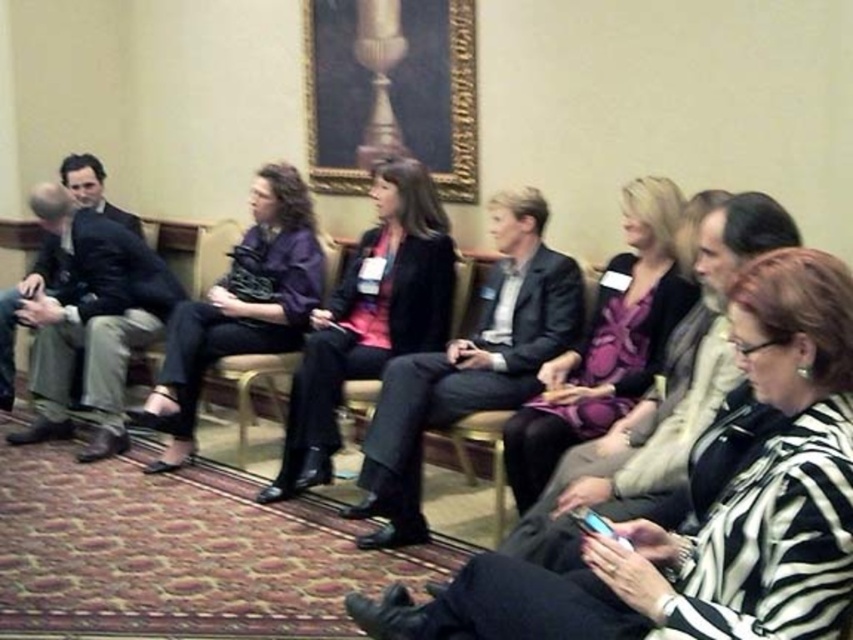
Question: Which of these objects is positioned farthest from the metallic gold chair at center?

Choices:
 (A) beige fabric chair at center
 (B) matte purple dress at center
 (C) matte black blazer at center
 (D) zebra-patterned jacket at center

Answer: (D)

Question: Which point appears closest to the camera in this image?

Choices:
 (A) (357, 360)
 (B) (199, 285)
 (C) (624, 344)
 (D) (144, 472)

Answer: (C)

Question: Can you confirm if zebra-patterned jacket at center is positioned above beige fabric chair at center?

Choices:
 (A) no
 (B) yes

Answer: (A)

Question: Can you confirm if matte black blazer at center is thinner than metallic gold chair at center?

Choices:
 (A) no
 (B) yes

Answer: (A)

Question: From the image, what is the correct spatial relationship of matte black blazer at center in relation to matte purple blouse at center?

Choices:
 (A) below
 (B) above

Answer: (A)

Question: Among these points, which one is nearest to the camera?

Choices:
 (A) (612, 294)
 (B) (328, 253)
 (C) (175, 404)
 (D) (840, 435)

Answer: (D)